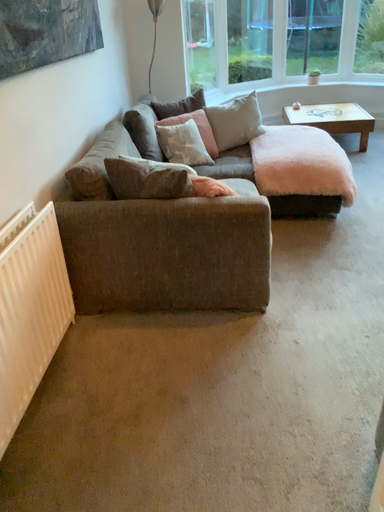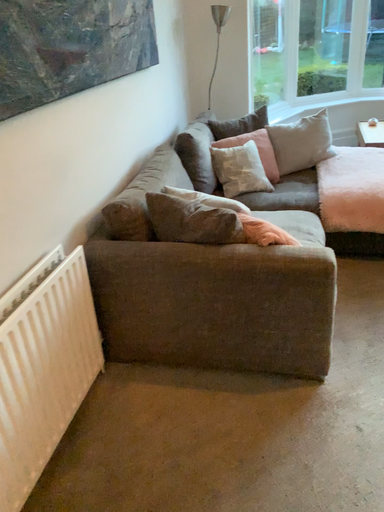
Question: Which way did the camera rotate in the video?

Choices:
 (A) rotated right
 (B) rotated left

Answer: (B)